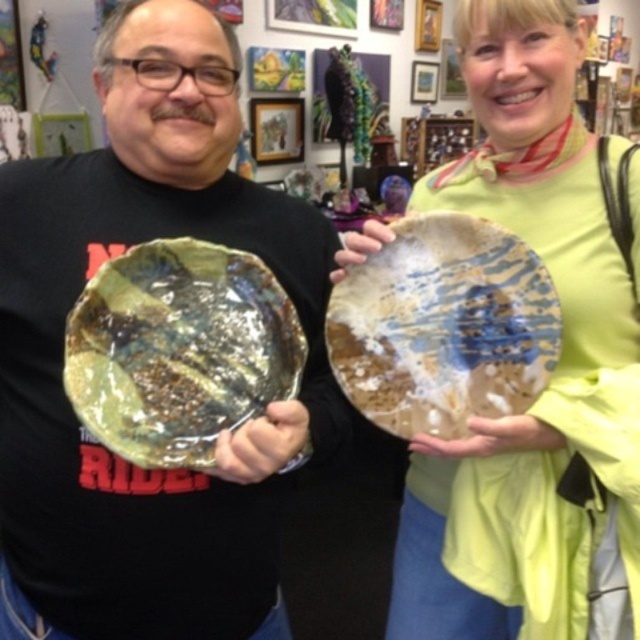
Between point (314, 288) and point (496, 8), which one is positioned behind?

The point (314, 288) is more distant.

Does metallic gold plate at center appear on the right side of matte ceramic plate at center?

No, metallic gold plate at center is not to the right of matte ceramic plate at center.

Which is behind, point (33, 301) or point (518, 604)?

Positioned behind is point (518, 604).

The image size is (640, 640). I want to click on metallic gold plate at center, so click(x=61, y=349).

Who is positioned more to the right, metallic gold plate at center or translucent amber plate at center?

translucent amber plate at center is more to the right.

Does metallic gold plate at center lie behind translucent amber plate at center?

No, it is not.

Locate an element on the screen. The image size is (640, 640). metallic gold plate at center is located at coordinates 61,349.

This screenshot has width=640, height=640. In order to click on metallic gold plate at center in this screenshot , I will do `click(61, 349)`.

Can you confirm if shiny metallic plate at center is positioned below translucent amber plate at center?

Yes, shiny metallic plate at center is below translucent amber plate at center.

Does shiny metallic plate at center have a lesser width compared to translucent amber plate at center?

Indeed, shiny metallic plate at center has a lesser width compared to translucent amber plate at center.

Where is `shiny metallic plate at center`? The height and width of the screenshot is (640, 640). shiny metallic plate at center is located at coordinates (179, 349).